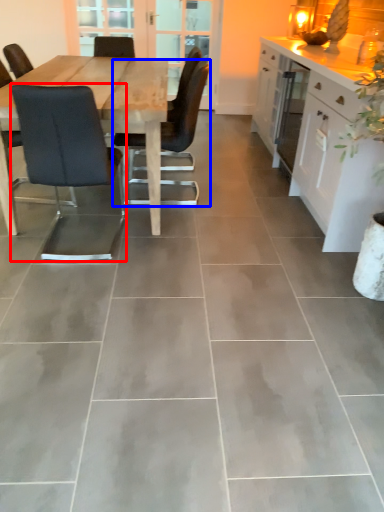
Question: Which of the following is the farthest to the observer, chair (highlighted by a red box) or chair (highlighted by a blue box)?

Choices:
 (A) chair
 (B) chair

Answer: (B)